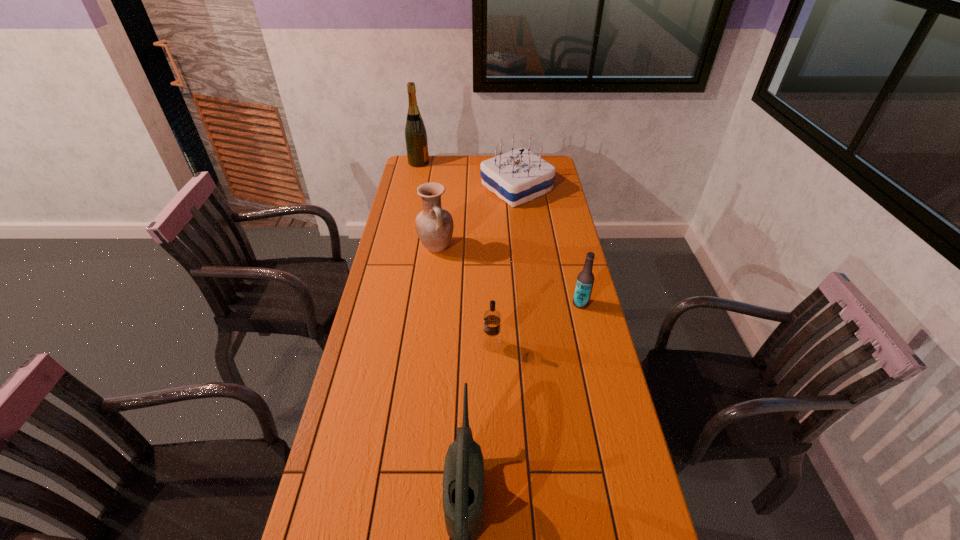
Locate an element on the screen. The height and width of the screenshot is (540, 960). wine bottle is located at coordinates (416, 141).

Image resolution: width=960 pixels, height=540 pixels. I want to click on the farthest object, so click(416, 141).

Where is `the fifth object from right to left`? The image size is (960, 540). the fifth object from right to left is located at coordinates 434,225.

At what (x,y) coordinates should I click in order to perform the action: click on pottery. Please return your answer as a coordinate pair (x, y). The image size is (960, 540). Looking at the image, I should click on (434, 225).

Where is `the fifth nearest object`? The image size is (960, 540). the fifth nearest object is located at coordinates (518, 176).

Where is `beer bottle`? The image size is (960, 540). beer bottle is located at coordinates (585, 279).

Where is `the second nearest object`? The height and width of the screenshot is (540, 960). the second nearest object is located at coordinates (491, 341).

At what (x,y) coordinates should I click in order to perform the action: click on vacant area located 0.280m on the front-facing side of the farthest object. Please return your answer as a coordinate pair (x, y). The height and width of the screenshot is (540, 960). Looking at the image, I should click on (483, 163).

Where is `vacant space located on the back of the fifth object from right to left`? vacant space located on the back of the fifth object from right to left is located at coordinates (443, 190).

Locate an element on the screen. vacant space situated on the left of the second farthest object is located at coordinates (466, 188).